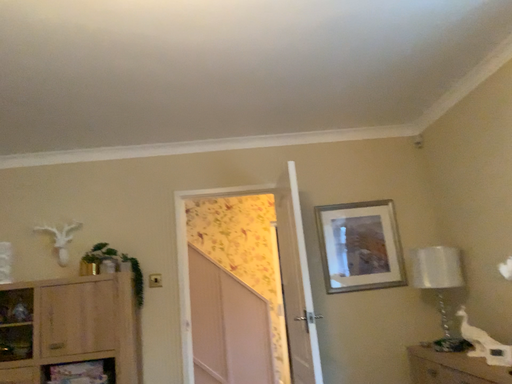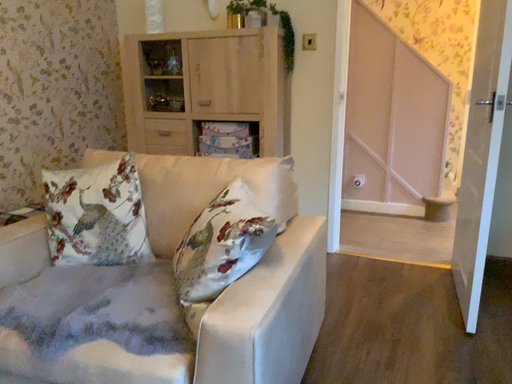
Question: Which way did the camera rotate in the video?

Choices:
 (A) rotated upward
 (B) rotated downward

Answer: (B)